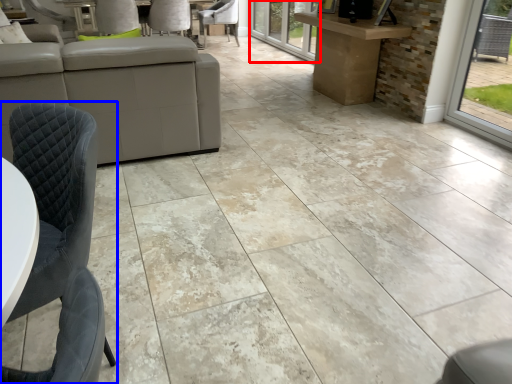
Question: Which of the following is the farthest to the observer, glass door (highlighted by a red box) or chair (highlighted by a blue box)?

Choices:
 (A) glass door
 (B) chair

Answer: (A)